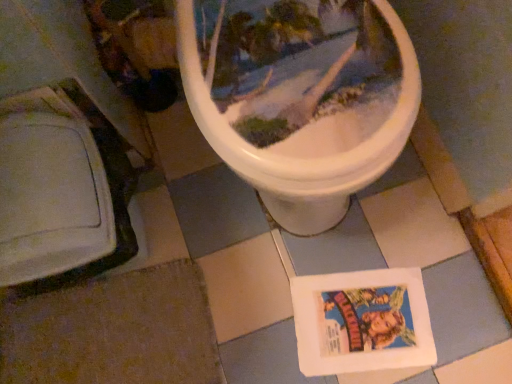
Locate an element on the screen. blank space situated above white paper comic book at lower center (from a real-world perspective) is located at coordinates (354, 314).